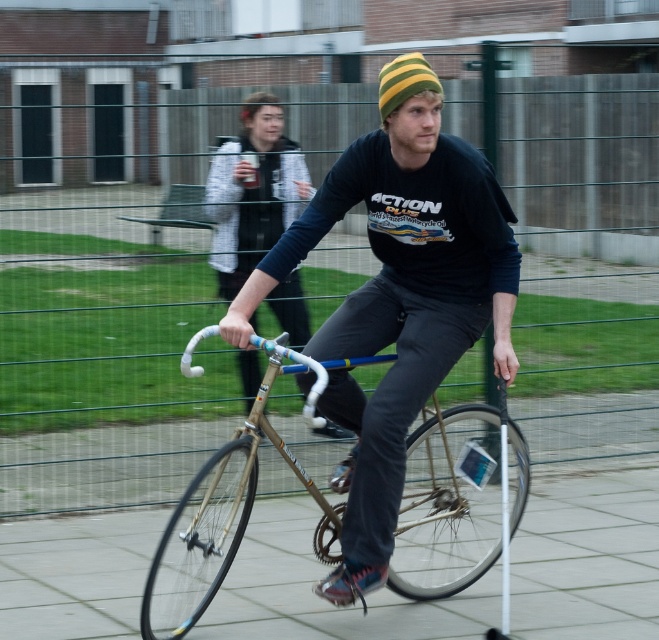
Question: Which point appears farthest from the camera in this image?

Choices:
 (A) (250, 177)
 (B) (415, 72)
 (C) (370, 548)
 (D) (426, 444)

Answer: (A)

Question: Is matte gold bicycle at center to the right of gold metallic bicycle at center from the viewer's perspective?

Choices:
 (A) yes
 (B) no

Answer: (B)

Question: Does gold metallic bicycle at center appear under striped knit beanie at center?

Choices:
 (A) no
 (B) yes

Answer: (B)

Question: Is matte gold bicycle at center above matte black bicycle at center?

Choices:
 (A) yes
 (B) no

Answer: (B)

Question: Which of these objects is positioned farthest from the gold metallic bicycle at center?

Choices:
 (A) smooth concrete pavement at center
 (B) matte black bicycle at center
 (C) matte gold bicycle at center

Answer: (B)

Question: Which point is farther from the camera taking this photo?

Choices:
 (A) (395, 77)
 (B) (409, 342)

Answer: (B)